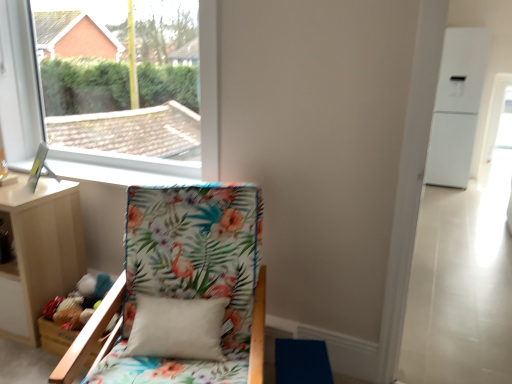
Question: Is light wood nightstand at lower left facing away from white plastic window at upper left?

Choices:
 (A) yes
 (B) no

Answer: (B)

Question: Is light wood nightstand at lower left shorter than white plastic window at upper left?

Choices:
 (A) no
 (B) yes

Answer: (B)

Question: Could you tell me if light wood nightstand at lower left is turned towards white plastic window at upper left?

Choices:
 (A) yes
 (B) no

Answer: (B)

Question: Is light wood nightstand at lower left far away from white plastic window at upper left?

Choices:
 (A) yes
 (B) no

Answer: (B)

Question: Is light wood nightstand at lower left with white plastic window at upper left?

Choices:
 (A) yes
 (B) no

Answer: (B)

Question: From a real-world perspective, does light wood nightstand at lower left stand above white plastic window at upper left?

Choices:
 (A) no
 (B) yes

Answer: (A)

Question: Are white plastic window at upper left and floral fabric chair at lower left making contact?

Choices:
 (A) no
 (B) yes

Answer: (A)

Question: Can you confirm if white plastic window at upper left is bigger than floral fabric chair at lower left?

Choices:
 (A) yes
 (B) no

Answer: (B)

Question: Considering the relative positions of white plastic window at upper left and floral fabric chair at lower left in the image provided, is white plastic window at upper left in front of floral fabric chair at lower left?

Choices:
 (A) no
 (B) yes

Answer: (A)

Question: Would you say white plastic window at upper left is a long distance from floral fabric chair at lower left?

Choices:
 (A) no
 (B) yes

Answer: (B)

Question: Can you confirm if white plastic window at upper left is wider than floral fabric chair at lower left?

Choices:
 (A) yes
 (B) no

Answer: (B)

Question: Is white plastic window at upper left looking in the opposite direction of floral fabric chair at lower left?

Choices:
 (A) no
 (B) yes

Answer: (A)

Question: Would you say light wood nightstand at lower left is outside floral fabric chair at lower left?

Choices:
 (A) no
 (B) yes

Answer: (B)